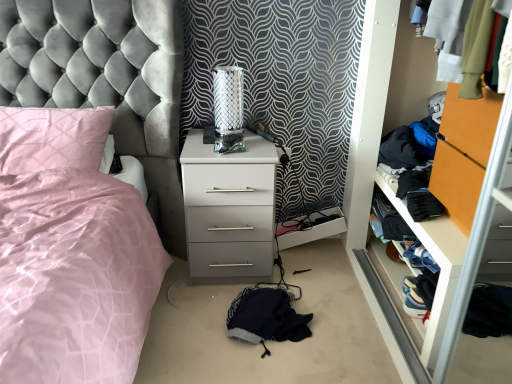
Find the location of a particular element. The width and height of the screenshot is (512, 384). vacant space in between white glossy chest of drawers at center and denim jeans at lower right, positioned as the third clothing in left-to-right order is located at coordinates (324, 279).